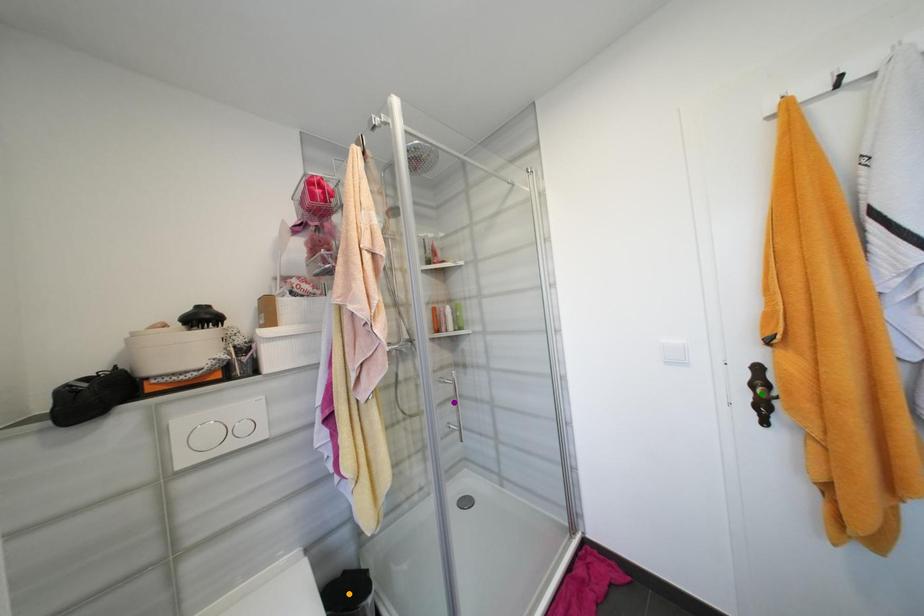
Order these from farthest to nearest:
1. purple point
2. orange point
3. green point

purple point
orange point
green point